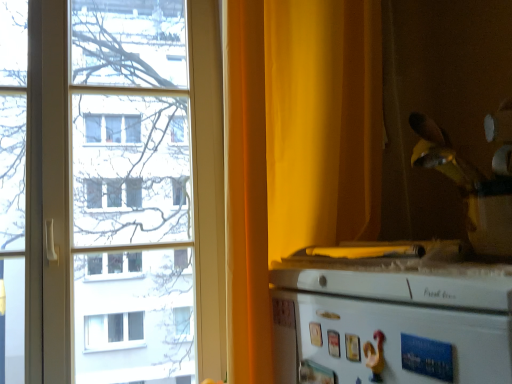
The image size is (512, 384). In order to click on white glossy refrigerator at lower right in this screenshot , I will do [x=391, y=321].

Identify the location of transparent glass window at left. [x=111, y=191].

Considering their positions, is yellow fabric curtain at right located in front of or behind white glossy refrigerator at lower right?

Visually, yellow fabric curtain at right is located behind white glossy refrigerator at lower right.

Is yellow fabric curtain at right looking in the opposite direction of white glossy refrigerator at lower right?

No.

From the image's perspective, is yellow fabric curtain at right located above or below white glossy refrigerator at lower right?

Clearly, from the image's perspective, yellow fabric curtain at right is above white glossy refrigerator at lower right.

Is yellow fabric curtain at right wider or thinner than white glossy refrigerator at lower right?

Clearly, yellow fabric curtain at right has more width compared to white glossy refrigerator at lower right.

Does transparent glass window at left have a greater height compared to yellow fabric curtain at right?

Yes.

Considering the relative sizes of transparent glass window at left and yellow fabric curtain at right in the image provided, is transparent glass window at left thinner than yellow fabric curtain at right?

Yes.

Is transparent glass window at left outside of yellow fabric curtain at right?

Yes, transparent glass window at left is located beyond the bounds of yellow fabric curtain at right.

Can you confirm if transparent glass window at left is positioned to the left of yellow fabric curtain at right?

Indeed, transparent glass window at left is positioned on the left side of yellow fabric curtain at right.

Choose the correct answer: Is white glossy refrigerator at lower right inside yellow fabric curtain at right or outside it?

white glossy refrigerator at lower right is located beyond the bounds of yellow fabric curtain at right.

Is white glossy refrigerator at lower right wider or thinner than yellow fabric curtain at right?

Considering their sizes, white glossy refrigerator at lower right looks slimmer than yellow fabric curtain at right.

From a real-world perspective, is white glossy refrigerator at lower right positioned above or below yellow fabric curtain at right?

Clearly, from a real-world perspective, white glossy refrigerator at lower right is below yellow fabric curtain at right.

This screenshot has height=384, width=512. I want to click on window above the yellow fabric curtain at right (from a real-world perspective), so click(x=111, y=191).

Do you think yellow fabric curtain at right is within transparent glass window at left, or outside of it?

yellow fabric curtain at right is located beyond the bounds of transparent glass window at left.

Could you tell me if yellow fabric curtain at right is turned towards transparent glass window at left?

No, yellow fabric curtain at right is not oriented towards transparent glass window at left.

From the picture: Would you say white glossy refrigerator at lower right is outside transparent glass window at left?

Yes, white glossy refrigerator at lower right is located beyond the bounds of transparent glass window at left.

From the image's perspective, does white glossy refrigerator at lower right appear lower than transparent glass window at left?

Correct, white glossy refrigerator at lower right appears lower than transparent glass window at left in the image.

Locate an element on the screen. The height and width of the screenshot is (384, 512). window behind the white glossy refrigerator at lower right is located at coordinates (111, 191).

Is transparent glass window at left oriented towards white glossy refrigerator at lower right?

Yes, transparent glass window at left is turned towards white glossy refrigerator at lower right.

Which of these two, transparent glass window at left or white glossy refrigerator at lower right, is bigger?

transparent glass window at left is bigger.

Which is more to the right, transparent glass window at left or white glossy refrigerator at lower right?

From the viewer's perspective, white glossy refrigerator at lower right appears more on the right side.

You are a GUI agent. You are given a task and a screenshot of the screen. Output one action in this format:
    pyautogui.click(x=<x>, y=<y>)
    Task: Click on the appliance in front of the yellow fabric curtain at right
    This screenshot has width=512, height=384.
    Given the screenshot: What is the action you would take?
    pyautogui.click(x=391, y=321)

The height and width of the screenshot is (384, 512). I want to click on curtain lying above the transparent glass window at left (from the image's perspective), so 295,148.

Which object lies further to the anchor point white glossy refrigerator at lower right, transparent glass window at left or yellow fabric curtain at right?

transparent glass window at left is positioned further to the anchor white glossy refrigerator at lower right.

Considering their positions, is transparent glass window at left positioned closer to yellow fabric curtain at right than white glossy refrigerator at lower right?

The object closer to yellow fabric curtain at right is white glossy refrigerator at lower right.

Which object lies further to the anchor point transparent glass window at left, yellow fabric curtain at right or white glossy refrigerator at lower right?

Among the two, white glossy refrigerator at lower right is located further to transparent glass window at left.

Estimate the real-world distances between objects in this image. Which object is closer to yellow fabric curtain at right, white glossy refrigerator at lower right or transparent glass window at left?

Based on the image, white glossy refrigerator at lower right appears to be nearer to yellow fabric curtain at right.

Considering their positions, is white glossy refrigerator at lower right positioned further to transparent glass window at left than yellow fabric curtain at right?

Based on the image, white glossy refrigerator at lower right appears to be further to transparent glass window at left.

Looking at the image, which one is located further to white glossy refrigerator at lower right, yellow fabric curtain at right or transparent glass window at left?

The object further to white glossy refrigerator at lower right is transparent glass window at left.

At what (x,y) coordinates should I click in order to perform the action: click on curtain located between transparent glass window at left and white glossy refrigerator at lower right in the left-right direction. Please return your answer as a coordinate pair (x, y). The height and width of the screenshot is (384, 512). Looking at the image, I should click on (295, 148).